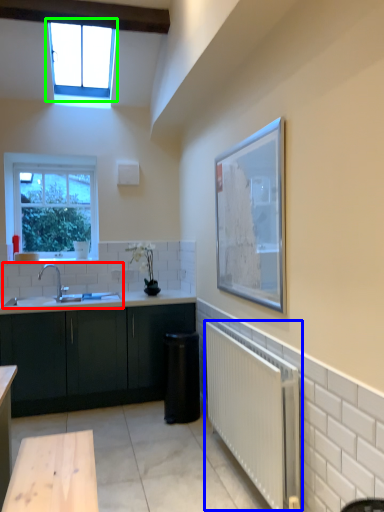
Question: Based on their relative distances, which object is farther from sink (highlighted by a red box)? Choose from radiator (highlighted by a blue box) and window (highlighted by a green box).

Choices:
 (A) radiator
 (B) window

Answer: (B)